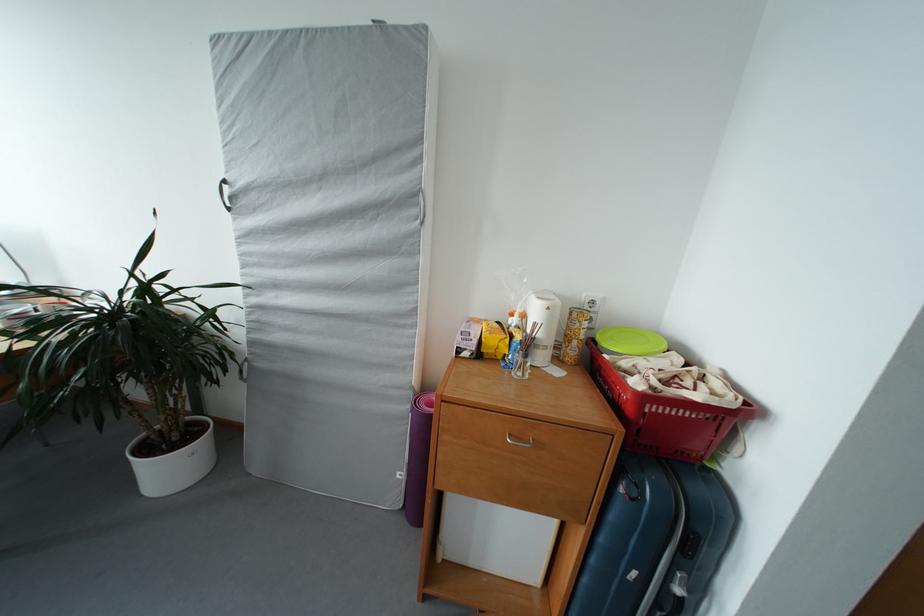
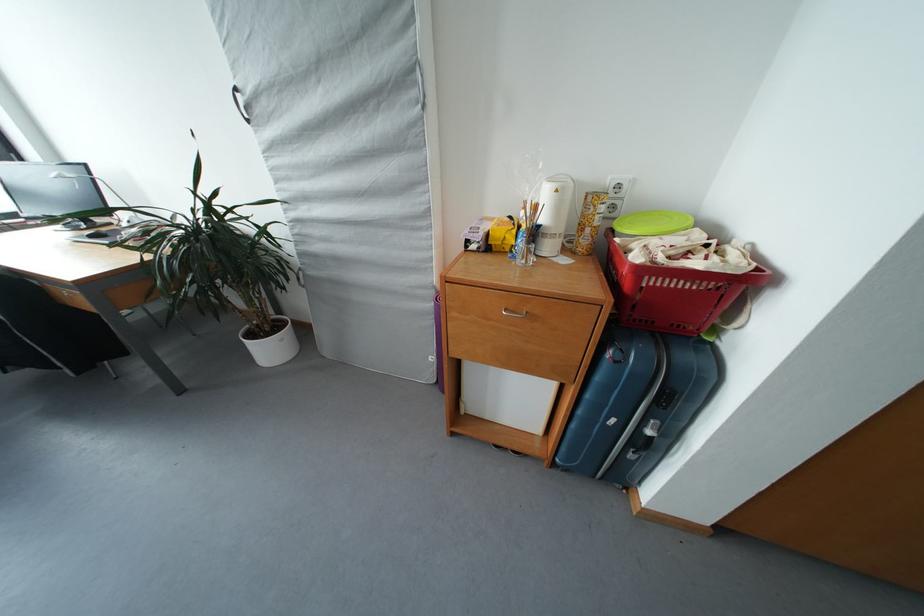
Locate, in the second image, the point that corresponds to point (554, 313) in the first image.

(563, 196)